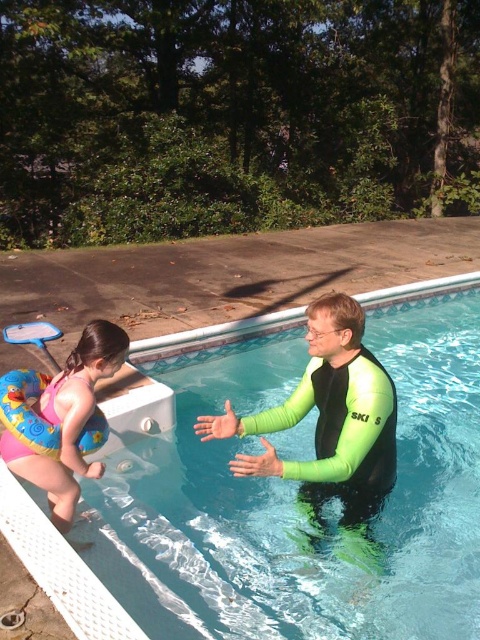
Is point (128, 412) farther from camera compared to point (50, 508)?

That is True.

Between clear blue water at center and pink rubber ring at lower left, which one appears on the left side from the viewer's perspective?

Positioned to the left is pink rubber ring at lower left.

Between point (157, 416) and point (60, 493), which one is positioned behind?

Positioned behind is point (157, 416).

Locate an element on the screen. Image resolution: width=480 pixels, height=640 pixels. clear blue water at center is located at coordinates (60, 570).

Between point (261, 433) and point (61, 513), which one is positioned behind?

The point (261, 433) is behind.

Who is positioned more to the left, green neoprene wetsuit at center or pink rubber ring at lower left?

pink rubber ring at lower left is more to the left.

Between point (309, 492) and point (103, 368), which one is positioned in front?

Point (103, 368) is in front.

Locate an element on the screen. The width and height of the screenshot is (480, 640). green neoprene wetsuit at center is located at coordinates (330, 428).

Which is more to the right, green neoprene wetsuit at center or clear blue water at center?

Positioned to the right is green neoprene wetsuit at center.

Does point (383, 483) come in front of point (63, 611)?

No, (383, 483) is behind (63, 611).

The width and height of the screenshot is (480, 640). Find the location of `green neoprene wetsuit at center`. green neoprene wetsuit at center is located at coordinates (330, 428).